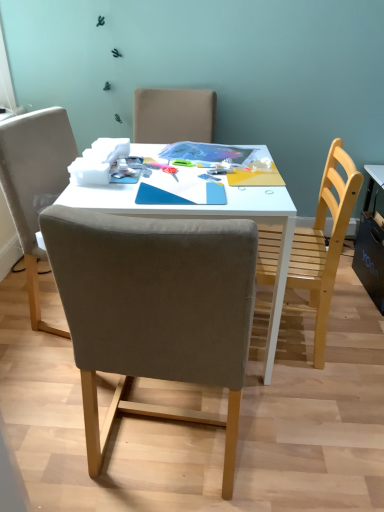
Question: Is wooden chair at right, positioned as the second chair in left-to-right order, at the left side of white glossy table at center?

Choices:
 (A) no
 (B) yes

Answer: (A)

Question: From the image's perspective, is wooden chair at right, the 1th chair viewed from the right, on top of white glossy table at center?

Choices:
 (A) yes
 (B) no

Answer: (A)

Question: Considering the relative sizes of wooden chair at right, the 1th chair viewed from the right, and white glossy table at center in the image provided, is wooden chair at right, the 1th chair viewed from the right, thinner than white glossy table at center?

Choices:
 (A) no
 (B) yes

Answer: (B)

Question: From a real-world perspective, is wooden chair at right, positioned as the second chair in left-to-right order, physically above white glossy table at center?

Choices:
 (A) yes
 (B) no

Answer: (A)

Question: Is wooden chair at right, positioned as the second chair in left-to-right order, facing towards white glossy table at center?

Choices:
 (A) no
 (B) yes

Answer: (B)

Question: Considering the relative positions of wooden chair at right, positioned as the second chair in left-to-right order, and white glossy table at center in the image provided, is wooden chair at right, positioned as the second chair in left-to-right order, to the right of white glossy table at center from the viewer's perspective?

Choices:
 (A) no
 (B) yes

Answer: (B)

Question: From the image's perspective, would you say suede-like beige chair at center, which is the second chair from right to left, is positioned over wooden chair at right, the 1th chair viewed from the right?

Choices:
 (A) no
 (B) yes

Answer: (A)

Question: Is suede-like beige chair at center, acting as the 1th chair starting from the left, oriented away from wooden chair at right, positioned as the second chair in left-to-right order?

Choices:
 (A) yes
 (B) no

Answer: (B)

Question: Can you confirm if suede-like beige chair at center, which is the second chair from right to left, is smaller than wooden chair at right, the 1th chair viewed from the right?

Choices:
 (A) no
 (B) yes

Answer: (A)

Question: Could you tell me if suede-like beige chair at center, acting as the 1th chair starting from the left, is turned towards wooden chair at right, positioned as the second chair in left-to-right order?

Choices:
 (A) no
 (B) yes

Answer: (A)

Question: Considering the relative positions of suede-like beige chair at center, which is the second chair from right to left, and wooden chair at right, positioned as the second chair in left-to-right order, in the image provided, is suede-like beige chair at center, which is the second chair from right to left, behind wooden chair at right, positioned as the second chair in left-to-right order,?

Choices:
 (A) no
 (B) yes

Answer: (A)

Question: Is suede-like beige chair at center, which is the second chair from right to left, shorter than wooden chair at right, positioned as the second chair in left-to-right order?

Choices:
 (A) no
 (B) yes

Answer: (A)

Question: Considering the relative sizes of suede-like beige chair at center, which is the second chair from right to left, and white glossy table at center in the image provided, is suede-like beige chair at center, which is the second chair from right to left, smaller than white glossy table at center?

Choices:
 (A) no
 (B) yes

Answer: (B)